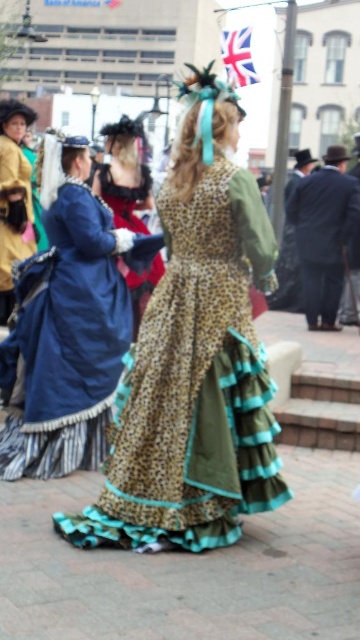
Question: Does leopard print dress at center appear on the left side of velvet red dress at center?

Choices:
 (A) yes
 (B) no

Answer: (A)

Question: Is leopard print fabric dress at center to the left of velvet red dress at center from the viewer's perspective?

Choices:
 (A) no
 (B) yes

Answer: (A)

Question: Which object is positioned closest to the dark blue suit at center?

Choices:
 (A) leopard print fabric dress at center
 (B) matte yellow coat at left

Answer: (B)

Question: Which point is farther from the camera taking this photo?

Choices:
 (A) (136, 278)
 (B) (51, 308)
 (C) (226, 362)

Answer: (A)

Question: Which object appears closest to the camera in this image?

Choices:
 (A) dark blue suit at center
 (B) leopard print dress at center
 (C) leopard print fabric dress at center

Answer: (C)

Question: Does leopard print dress at center have a larger size compared to velvet red dress at center?

Choices:
 (A) no
 (B) yes

Answer: (B)